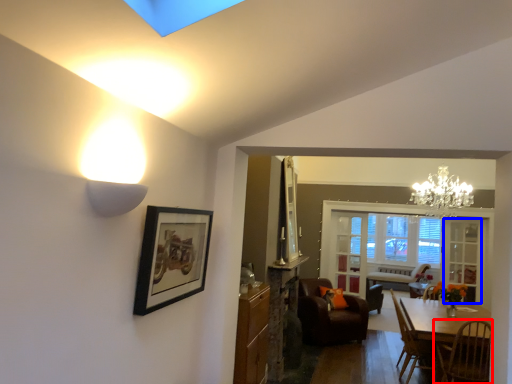
Question: Among these objects, which one is farthest to the camera, chair (highlighted by a red box) or glass door (highlighted by a blue box)?

Choices:
 (A) chair
 (B) glass door

Answer: (B)